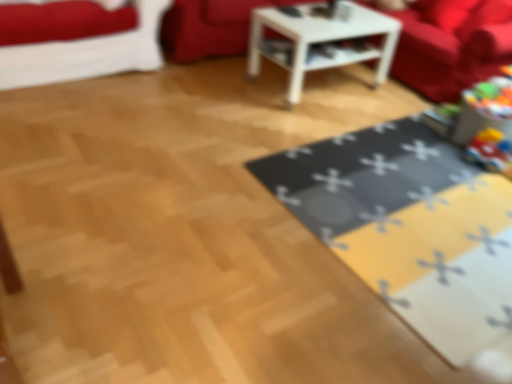
Question: Is velvet red couch at upper center, which ranks as the 1th couch in left-to-right order, not close to yellow fabric mat at lower right?

Choices:
 (A) yes
 (B) no

Answer: (A)

Question: Can you see velvet red couch at upper center, which appears as the second couch when viewed from the right, touching yellow fabric mat at lower right?

Choices:
 (A) no
 (B) yes

Answer: (A)

Question: Considering the relative positions of velvet red couch at upper center, which ranks as the 1th couch in left-to-right order, and yellow fabric mat at lower right in the image provided, is velvet red couch at upper center, which ranks as the 1th couch in left-to-right order, to the left of yellow fabric mat at lower right from the viewer's perspective?

Choices:
 (A) yes
 (B) no

Answer: (A)

Question: Is yellow fabric mat at lower right at the back of velvet red couch at upper center, which ranks as the 1th couch in left-to-right order?

Choices:
 (A) no
 (B) yes

Answer: (A)

Question: Is yellow fabric mat at lower right surrounded by velvet red couch at upper center, which appears as the second couch when viewed from the right?

Choices:
 (A) yes
 (B) no

Answer: (B)

Question: Is velvet red couch at upper center, which appears as the second couch when viewed from the right, not within yellow fabric mat at lower right?

Choices:
 (A) yes
 (B) no

Answer: (A)

Question: Is velvet red couch at upper center, which appears as the second couch when viewed from the right, closer to the viewer compared to white glossy table at center?

Choices:
 (A) yes
 (B) no

Answer: (B)

Question: Is velvet red couch at upper center, which ranks as the 1th couch in left-to-right order, oriented towards white glossy table at center?

Choices:
 (A) no
 (B) yes

Answer: (B)

Question: From the image's perspective, is velvet red couch at upper center, which appears as the second couch when viewed from the right, beneath white glossy table at center?

Choices:
 (A) yes
 (B) no

Answer: (B)

Question: Is white glossy table at center at the back of velvet red couch at upper center, which appears as the second couch when viewed from the right?

Choices:
 (A) no
 (B) yes

Answer: (A)

Question: Considering the relative sizes of velvet red couch at upper center, which appears as the second couch when viewed from the right, and white glossy table at center in the image provided, is velvet red couch at upper center, which appears as the second couch when viewed from the right, shorter than white glossy table at center?

Choices:
 (A) yes
 (B) no

Answer: (A)

Question: Is velvet red couch at upper center, which ranks as the 1th couch in left-to-right order, outside white glossy table at center?

Choices:
 (A) no
 (B) yes

Answer: (B)

Question: Is there a large distance between velvet red couch at upper right, the second couch viewed from the left, and yellow fabric mat at lower right?

Choices:
 (A) yes
 (B) no

Answer: (A)